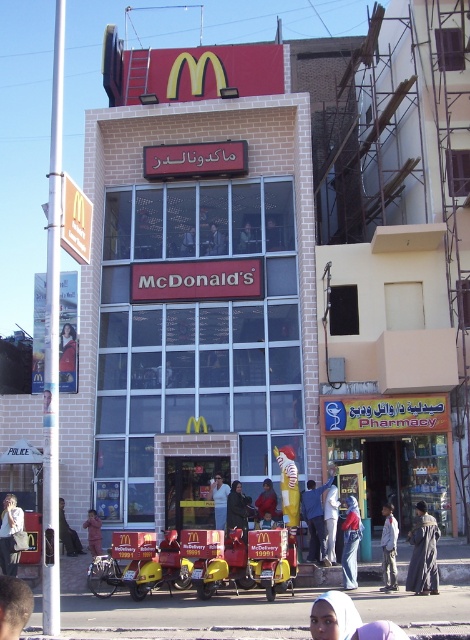
Who is positioned more to the left, blue denim jeans at center or red fabric person at lower left?

From the viewer's perspective, red fabric person at lower left appears more on the left side.

Who is higher up, blue denim jeans at center or red fabric person at lower left?

Positioned higher is blue denim jeans at center.

Does point (310, 515) lie behind point (94, 512)?

No, it is not.

Identify the location of blue denim jeans at center. The image size is (470, 640). (314, 520).

Which is more to the right, blue denim jeans at center or dark brown leather jacket at lower left?

blue denim jeans at center

Is the position of blue denim jeans at center more distant than that of dark brown leather jacket at lower left?

No, it is in front of dark brown leather jacket at lower left.

Which is in front, point (319, 541) or point (62, 538)?

Point (319, 541) is more forward.

This screenshot has width=470, height=640. What are the coordinates of `blue denim jeans at center` in the screenshot? It's located at (314, 520).

Does dark brown textured robe at lower right appear under denim jeans at lower center?

No, dark brown textured robe at lower right is not below denim jeans at lower center.

Does point (427, 556) lie in front of point (361, 529)?

That is True.

Describe the element at coordinates (423, 554) in the screenshot. I see `dark brown textured robe at lower right` at that location.

This screenshot has width=470, height=640. In order to click on dark brown textured robe at lower right in this screenshot , I will do `click(423, 554)`.